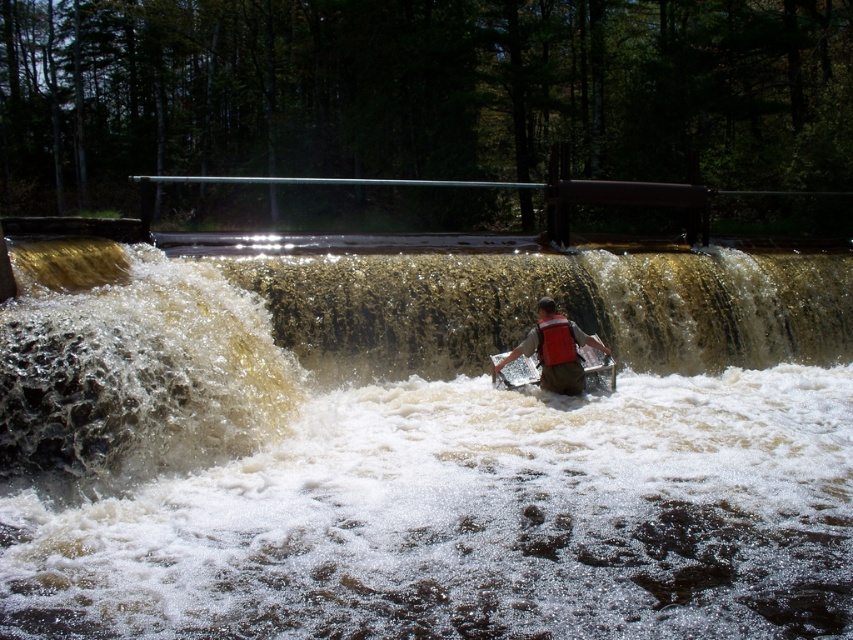
You are navigating a small boat through the waterfall area shown in the image. You need to pass between the two points labeled as point (738, 289) and point (556, 317). Which point should you approach first to ensure safe passage?

You should approach point (556, 317) first because point (738, 289) is behind it, so navigating towards the closer point first ensures a safer path through the waterfall area.

Based on the photo, you are a hiker who wants to cross the brown textured water at center near the orange life vest at center. Which direction should you move to get to the water from the vest?

The brown textured water at center is positioned on the left side of orange life vest at center, so you should move to the left to reach the water from the vest.